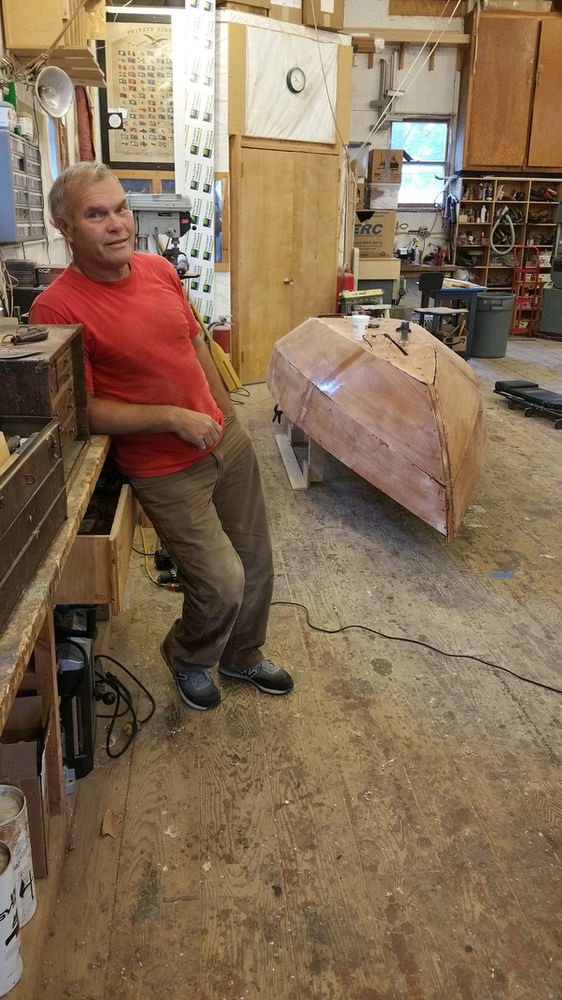
This screenshot has height=1000, width=562. I want to click on open drawer, so click(98, 551).